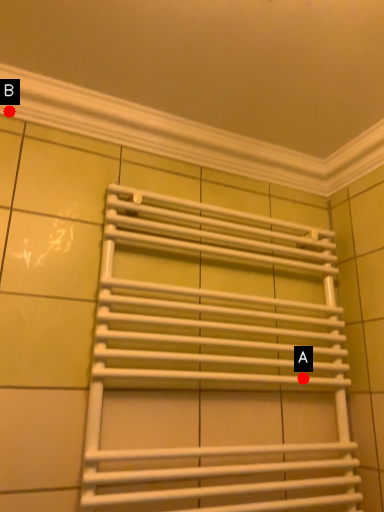
Question: Two points are circled on the image, labeled by A and B beside each circle. Which point is closer to the camera?

Choices:
 (A) A is closer
 (B) B is closer

Answer: (B)